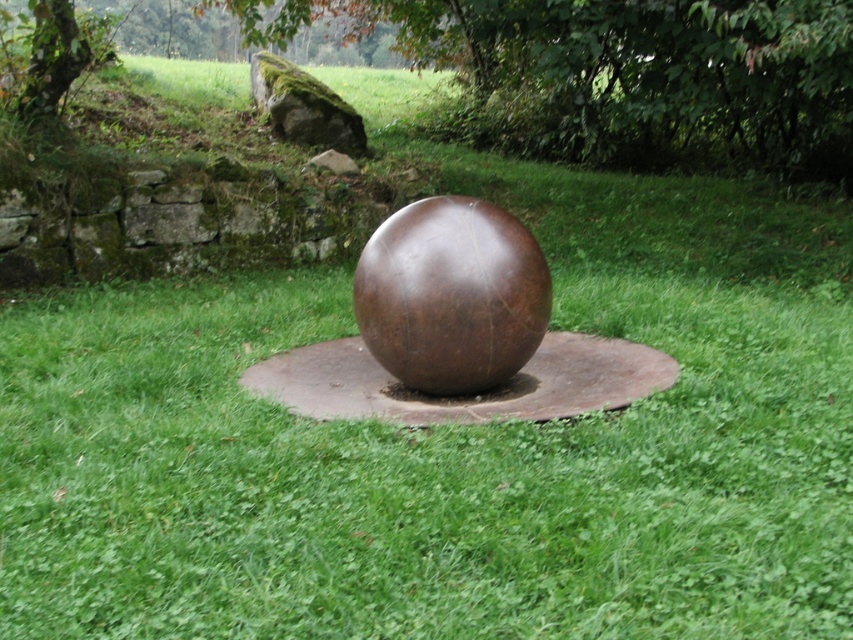
You are standing in the outdoor area looking at the scene. There is a brown leather sphere at center and a mossy rock at upper left. Which object is positioned to the right side of the other?

The brown leather sphere at center is positioned to the right of mossy rock at upper left.

You are standing at the center of the grassy area and want to place a small decorative stone exactly 1 meter to the north of the brown leather sphere at center. According to the coordinates provided, where should you place the stone?

The brown leather sphere at center is located at point (451, 296). To place the decorative stone 1 meter north, you would need to adjust the y coordinate by adding 1 meter. However, without knowing the scale of the coordinate system, it is impossible to determine the exact placement. Please provide the scale of the coordinate system to proceed.